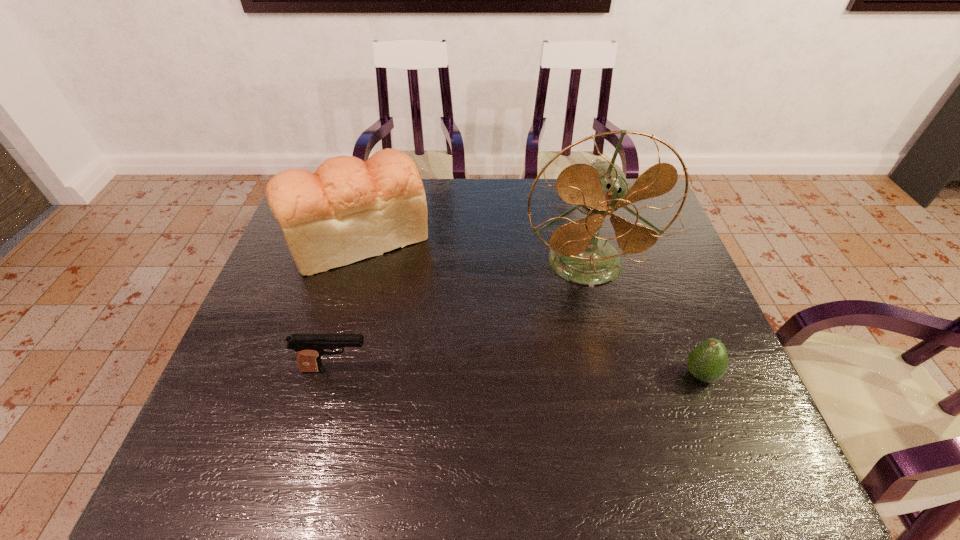
Image resolution: width=960 pixels, height=540 pixels. Identify the location of free area in between the third shortest object and the tallest object. (472, 249).

You are a GUI agent. You are given a task and a screenshot of the screen. Output one action in this format:
    pyautogui.click(x=<x>, y=<y>)
    Task: Click on the vacant space that's between the bread and the avocado
    The height and width of the screenshot is (540, 960).
    Given the screenshot: What is the action you would take?
    pyautogui.click(x=530, y=306)

Identify the location of free spot between the pistol and the tallest object. The image size is (960, 540). pyautogui.click(x=461, y=315).

Where is `vacant area that lies between the pistol and the avocado`? vacant area that lies between the pistol and the avocado is located at coordinates (518, 372).

You are a GUI agent. You are given a task and a screenshot of the screen. Output one action in this format:
    pyautogui.click(x=<x>, y=<y>)
    Task: Click on the free spot between the second tallest object and the tallest object
    
    Given the screenshot: What is the action you would take?
    pyautogui.click(x=472, y=249)

Where is `free area in between the pistol and the second tallest object`? free area in between the pistol and the second tallest object is located at coordinates (348, 303).

The image size is (960, 540). Identify the location of vacant area that lies between the avocado and the fan. (642, 319).

Locate an element on the screen. Image resolution: width=960 pixels, height=540 pixels. vacant space that is in between the pistol and the fan is located at coordinates (461, 315).

This screenshot has width=960, height=540. Find the location of `vacant area between the pistol and the tallest object`. vacant area between the pistol and the tallest object is located at coordinates (461, 315).

Where is `unoccupied position between the avocado and the bread`? The height and width of the screenshot is (540, 960). unoccupied position between the avocado and the bread is located at coordinates (530, 306).